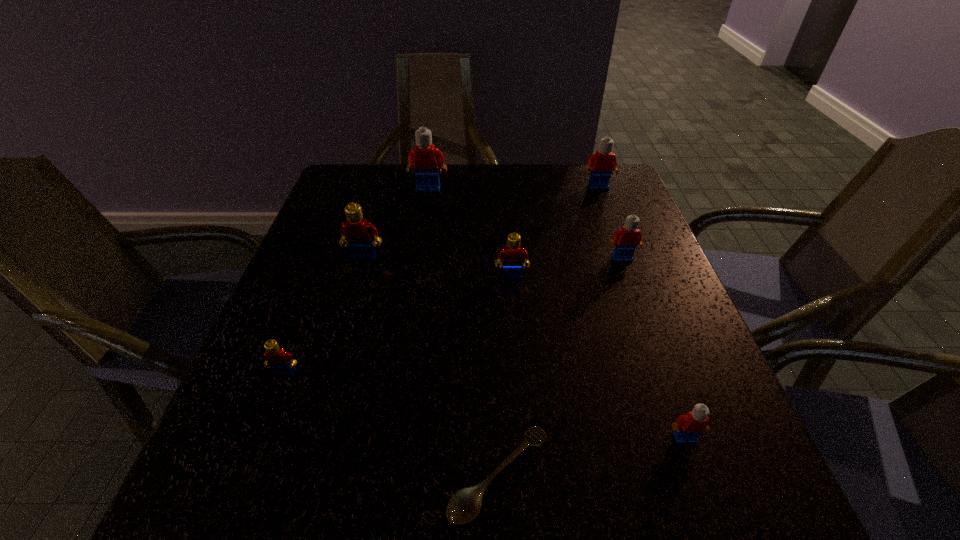
Where is `the third Lego from left to right`? the third Lego from left to right is located at coordinates (426, 158).

Locate an element on the screen. the tallest Lego is located at coordinates (426, 158).

Identify the location of the biggest red Lego. (357, 233).

What are the coordinates of `the second object from left to right` in the screenshot? It's located at (357, 233).

Where is `the second biggest white Lego`? the second biggest white Lego is located at coordinates (603, 163).

You are a GUI agent. You are given a task and a screenshot of the screen. Output one action in this format:
    pyautogui.click(x=<x>, y=<y>)
    Task: Click on the second nearest white Lego
    This screenshot has height=540, width=960.
    Given the screenshot: What is the action you would take?
    pyautogui.click(x=629, y=237)

At what (x,y) coordinates should I click in order to perform the action: click on the fourth Lego from right to left. Please return your answer as a coordinate pair (x, y). Image resolution: width=960 pixels, height=540 pixels. Looking at the image, I should click on (511, 255).

Image resolution: width=960 pixels, height=540 pixels. What are the coordinates of `the second smallest red Lego` in the screenshot? It's located at (511, 255).

The height and width of the screenshot is (540, 960). In order to click on the leftmost object in this screenshot , I will do `click(281, 362)`.

Image resolution: width=960 pixels, height=540 pixels. Find the location of `the smallest red Lego`. the smallest red Lego is located at coordinates (281, 362).